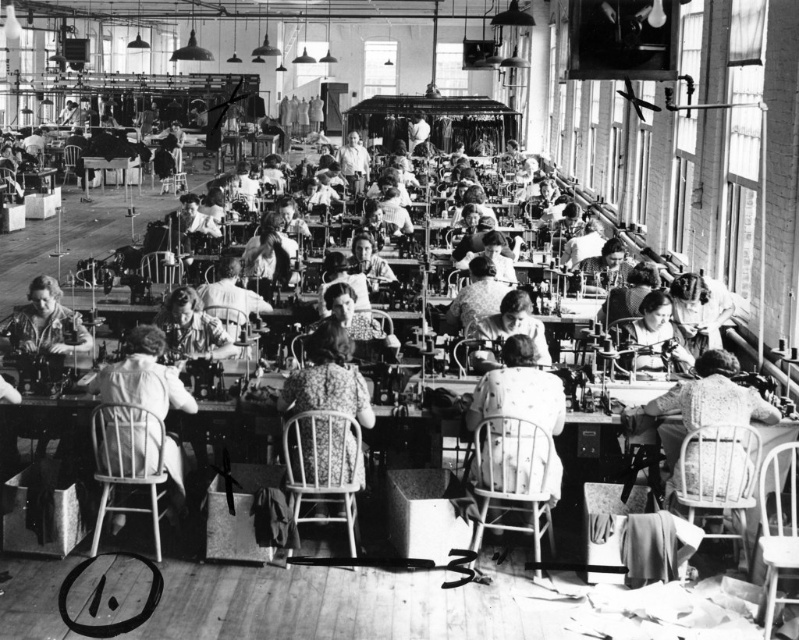
You are a factory manager inspecting the sewing area. You notice the wooden table at center and the floral fabric dress at center. Which object is smaller in size?

The wooden table at center has a smaller size compared to the floral fabric dress at center, so the wooden table at center is smaller.

You are standing at the entrance of the factory and need to reach the wooden table at center. Which direction should you head towards based on the coordinates provided?

The wooden table at center is located at coordinates point (54,417), so you should head towards the right and slightly forward from the entrance to reach it.